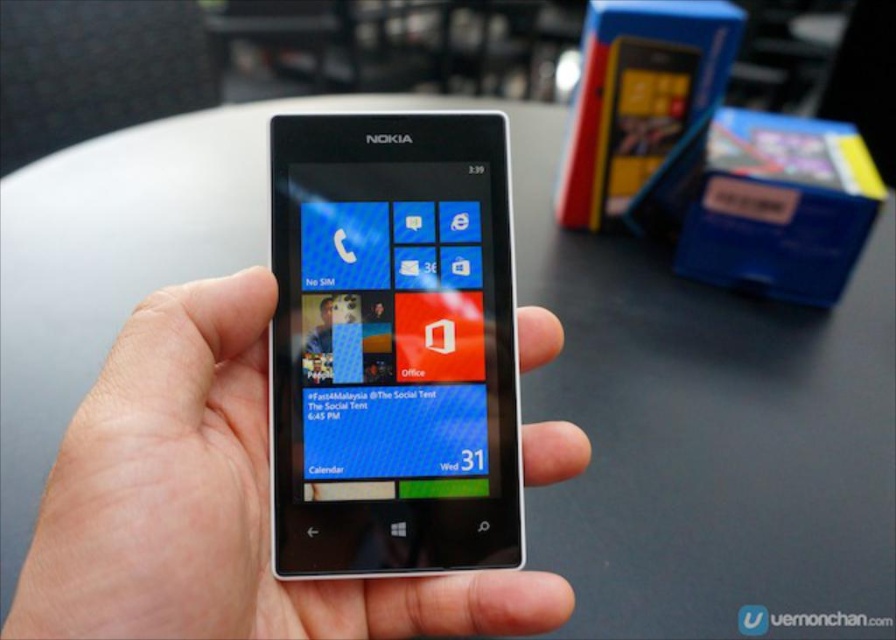
Question: Which of the following is the farthest from the observer?

Choices:
 (A) blue glossy screen at center
 (B) white matte phone at center

Answer: (A)

Question: Does white matte phone at center have a greater width compared to blue glossy screen at center?

Choices:
 (A) yes
 (B) no

Answer: (A)

Question: Where is white matte phone at center located in relation to blue glossy screen at center in the image?

Choices:
 (A) right
 (B) left

Answer: (B)

Question: Is white matte phone at center to the right of blue glossy screen at center from the viewer's perspective?

Choices:
 (A) no
 (B) yes

Answer: (A)

Question: Which object appears closest to the camera in this image?

Choices:
 (A) white matte phone at center
 (B) blue glossy screen at center

Answer: (A)